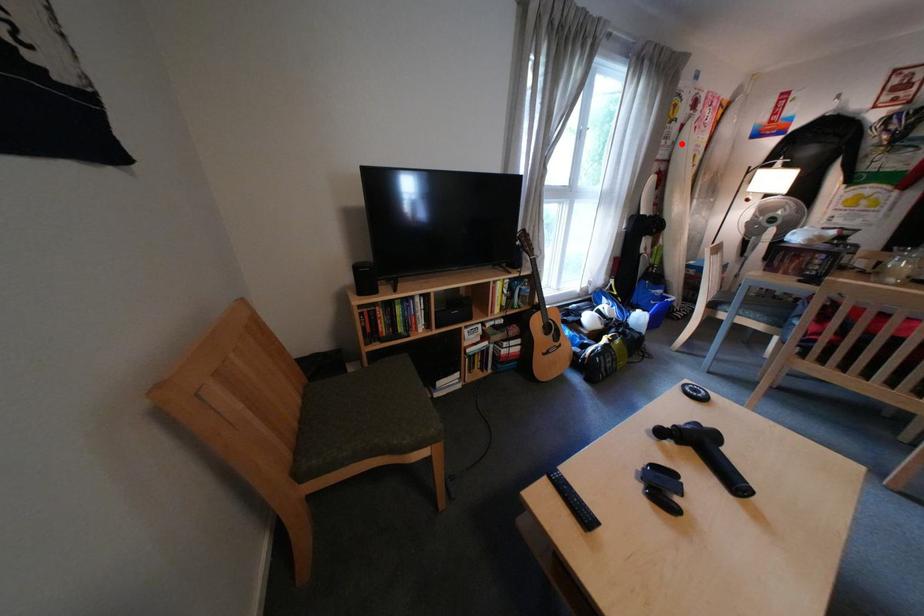
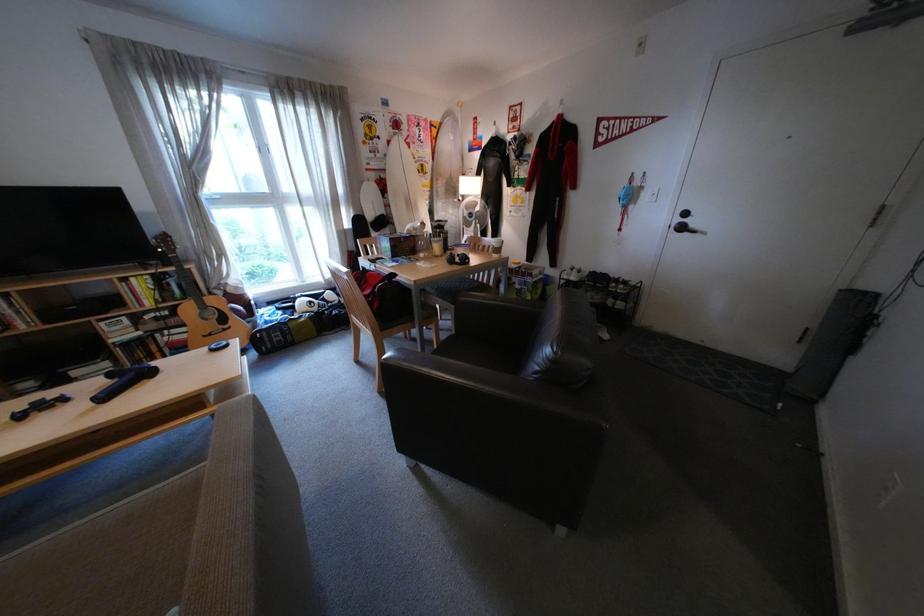
In the second image, find the point that corresponds to the highlighted location in the first image.

(392, 156)